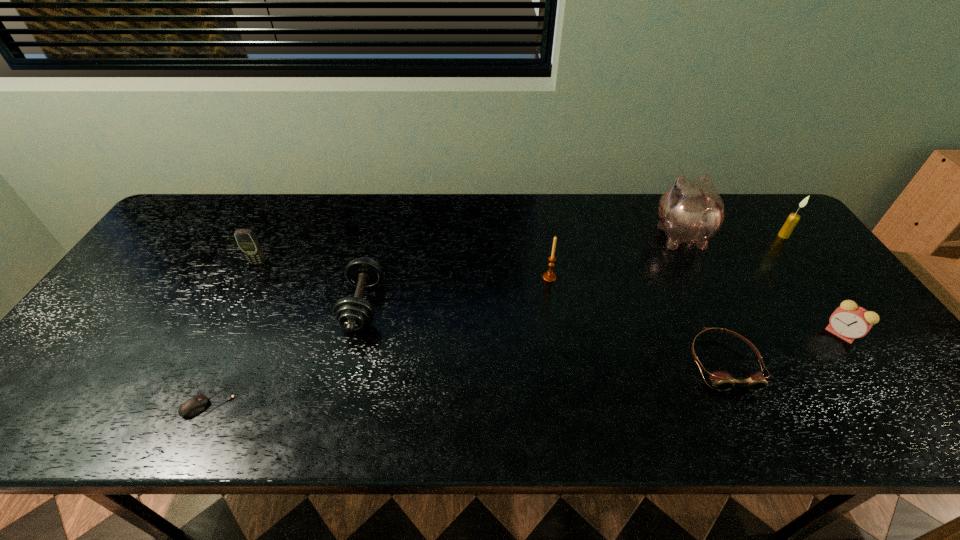
This screenshot has width=960, height=540. In order to click on empty location between the goggles and the dumbbell in this screenshot , I will do `click(542, 334)`.

At what (x,y) coordinates should I click in order to perform the action: click on vacant area that lies between the goggles and the piggy bank. Please return your answer as a coordinate pair (x, y). This screenshot has height=540, width=960. Looking at the image, I should click on (702, 299).

This screenshot has width=960, height=540. I want to click on object that is the second closest to the seventh tallest object, so click(x=690, y=211).

Point out which object is positioned as the second nearest to the fourth tallest object. Please provide its 2D coordinates. Your answer should be formatted as a tuple, i.e. [(x, y)], where the tuple contains the x and y coordinates of a point satisfying the conditions above.

[(196, 404)]

The image size is (960, 540). In order to click on free space that satisfies the following two spatial constraints: 1. on the back side of the dumbbell; 2. on the right side of the mouse in this screenshot , I will do [255, 306].

This screenshot has width=960, height=540. In order to click on vacant area that satisfies the following two spatial constraints: 1. on the front face of the cellular telephone; 2. on the left side of the sixth object from right to left in this screenshot , I will do `click(236, 306)`.

I want to click on vacant space that satisfies the following two spatial constraints: 1. on the front face of the sixth object from right to left; 2. on the right side of the sixth nearest object, so point(236,306).